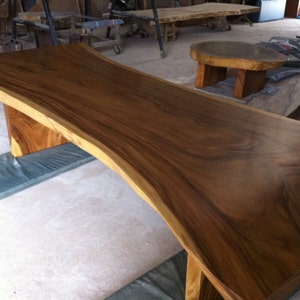
Where is `cushions`? This screenshot has height=300, width=300. cushions is located at coordinates (219, 90), (230, 82), (24, 175), (160, 286).